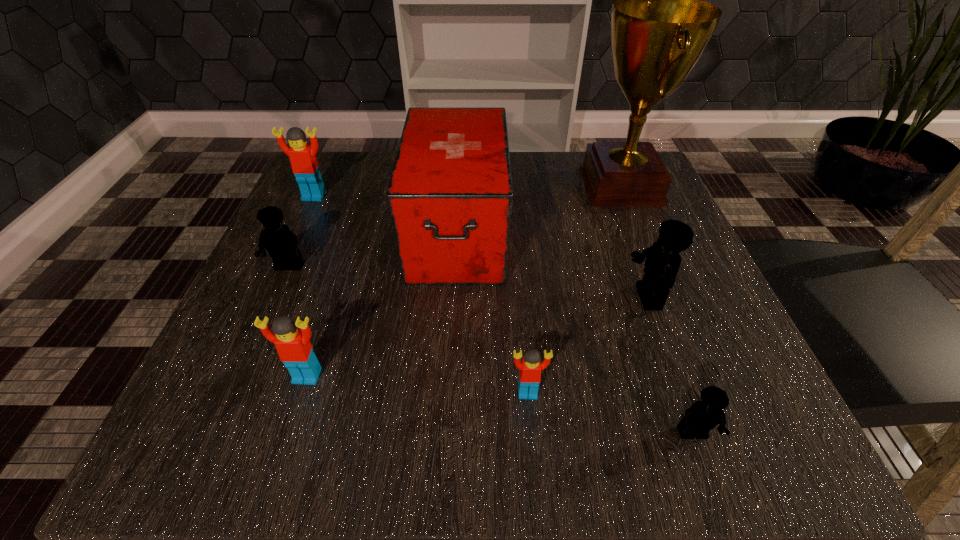
Find the location of `gold award`. gold award is located at coordinates (660, 27).

Image resolution: width=960 pixels, height=540 pixels. Find the location of `award`. award is located at coordinates (660, 27).

Where is `the first-aid kit`? This screenshot has height=540, width=960. the first-aid kit is located at coordinates (450, 195).

The width and height of the screenshot is (960, 540). Find the location of `the farthest red Lego`. the farthest red Lego is located at coordinates (305, 167).

Where is `the biggest red Lego`? This screenshot has height=540, width=960. the biggest red Lego is located at coordinates (305, 167).

I want to click on the second farthest yellow Lego, so click(x=662, y=263).

Identify the location of the biggest yellow Lego. This screenshot has height=540, width=960. (662, 263).

At what (x,y) coordinates should I click in order to perform the action: click on the fourth farthest Lego. Please return your answer as a coordinate pair (x, y). This screenshot has width=960, height=540. Looking at the image, I should click on (293, 345).

In order to click on the fourth Lego from right to left in this screenshot , I will do `click(293, 345)`.

This screenshot has width=960, height=540. I want to click on the farthest yellow Lego, so click(281, 243).